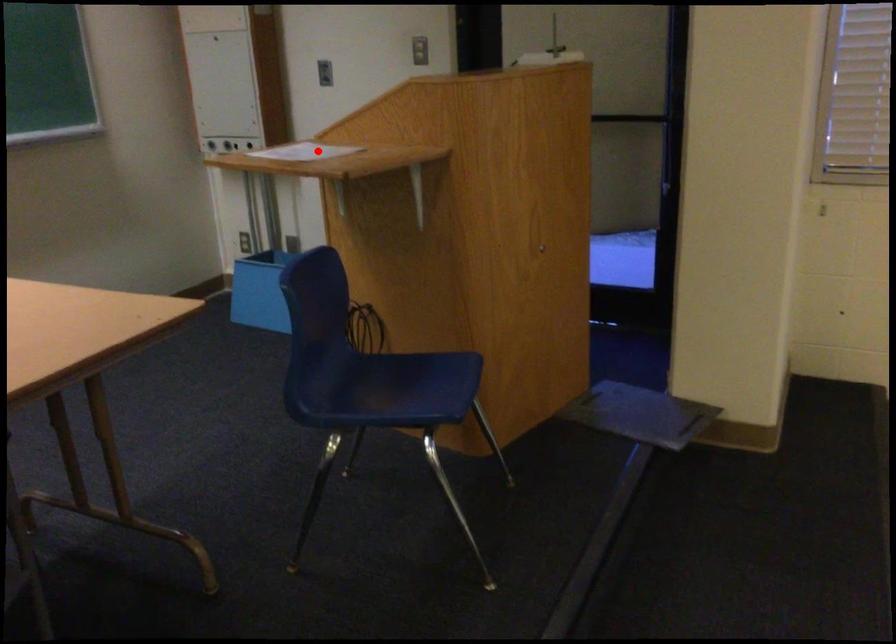
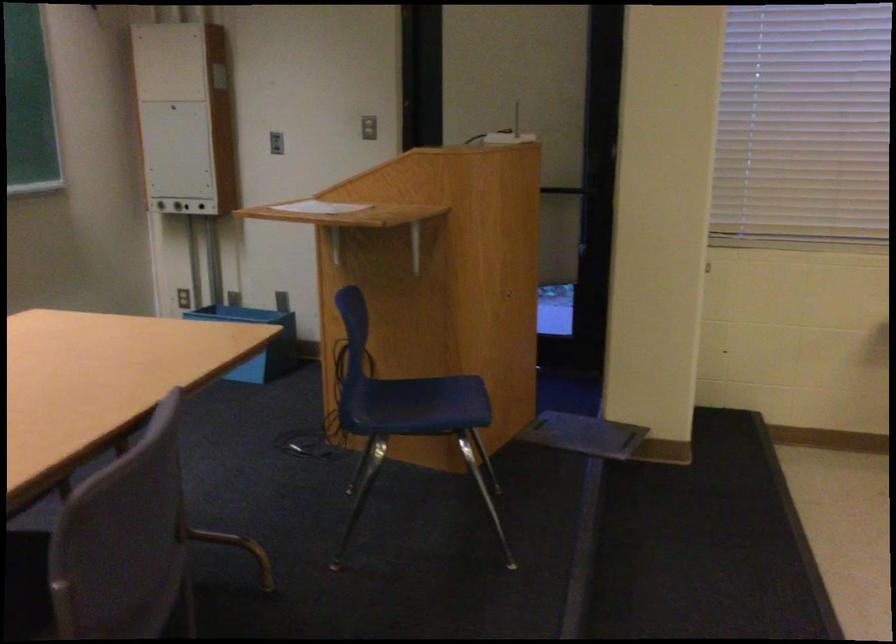
Question: I am providing you with two images of the same scene from different viewpoints. Given a red point in image1, look at the same physical point in image2. Is it:

Choices:
 (A) Closer to the viewpoint
 (B) Farther from the viewpoint

Answer: (B)